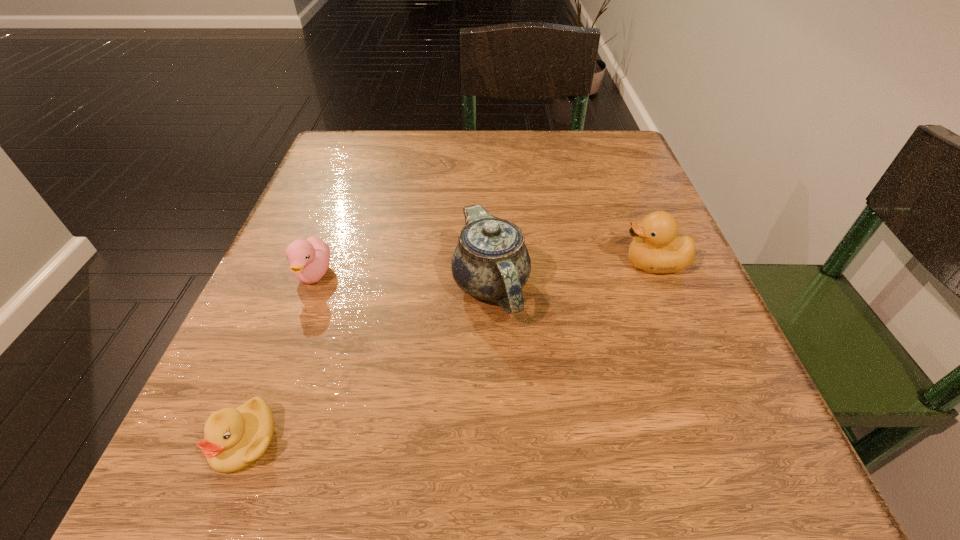
Select which object is the closest to the tallest duckling. Please provide its 2D coordinates. Your answer should be formatted as a tuple, i.e. [(x, y)], where the tuple contains the x and y coordinates of a point satisfying the conditions above.

[(491, 262)]

Where is `object that stands as the second closest to the shortest object`? This screenshot has width=960, height=540. object that stands as the second closest to the shortest object is located at coordinates (491, 262).

Select which duckling is the second closest to the nearest duckling. Please provide its 2D coordinates. Your answer should be formatted as a tuple, i.e. [(x, y)], where the tuple contains the x and y coordinates of a point satisfying the conditions above.

[(657, 248)]

Choose which duckling is the nearest neighbor to the tallest object. Please provide its 2D coordinates. Your answer should be formatted as a tuple, i.e. [(x, y)], where the tuple contains the x and y coordinates of a point satisfying the conditions above.

[(657, 248)]

Identify the location of vacant space that satisfies the following two spatial constraints: 1. facing forward on the rightmost object; 2. on the front-facing side of the shortest object. (725, 440).

Find the location of a particular element. This screenshot has height=540, width=960. free region that satisfies the following two spatial constraints: 1. facing forward on the rightmost duckling; 2. from the spout of the tallest object is located at coordinates (662, 286).

At what (x,y) coordinates should I click in order to perform the action: click on free space in the image that satisfies the following two spatial constraints: 1. facing forward on the tallest duckling; 2. from the spout of the tallest object. Please return your answer as a coordinate pair (x, y). The image size is (960, 540). Looking at the image, I should click on (662, 286).